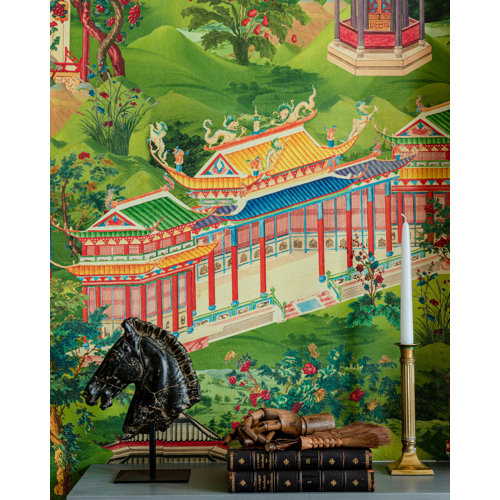
Where is `front left corner of candle base`? front left corner of candle base is located at coordinates (389, 470).